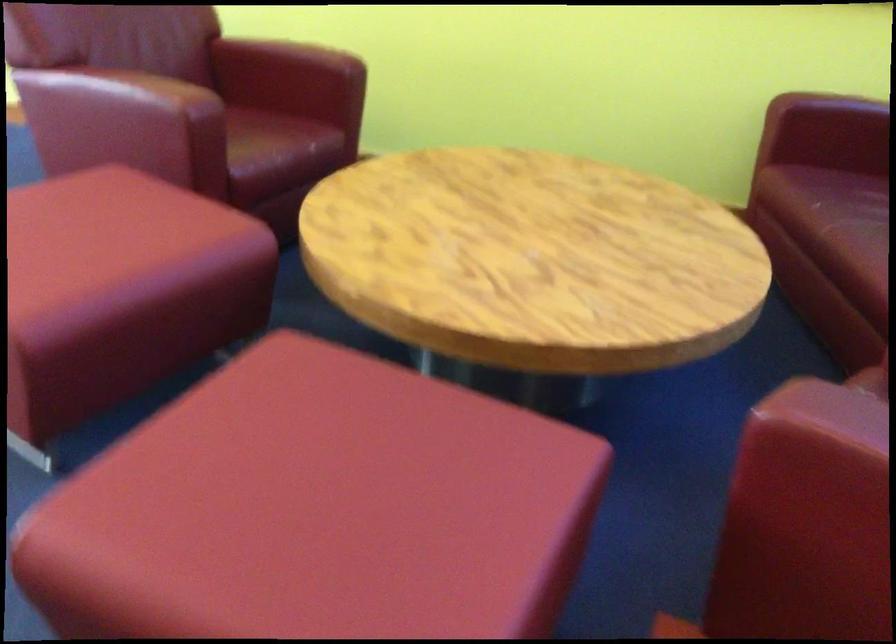
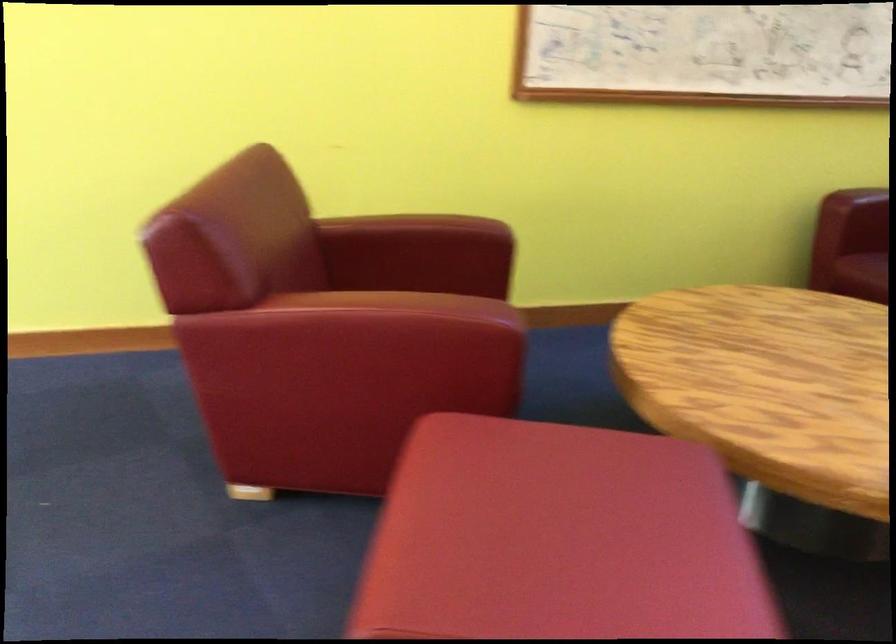
From the picture: Which direction would the cameraman need to move to produce the second image?

The movement direction of the cameraman is left, forward.